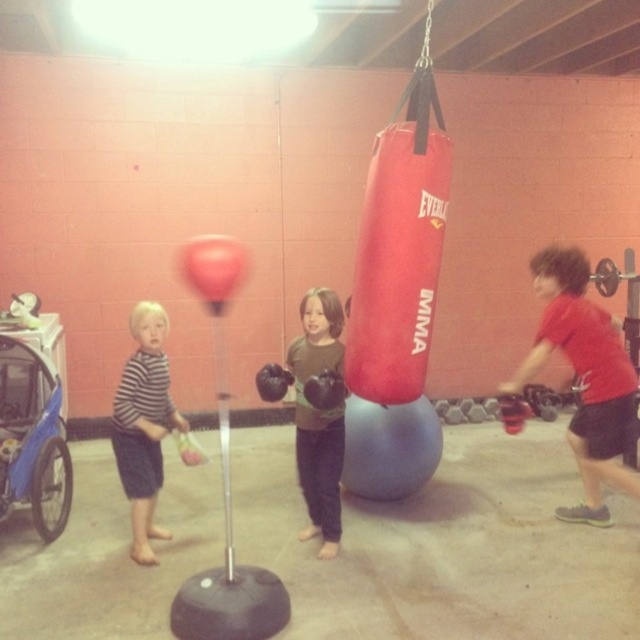
Between red matte boxing glove at right and matte black boxing gloves at center, which one appears on the right side from the viewer's perspective?

red matte boxing glove at right

From the picture: Can you confirm if red matte boxing glove at right is wider than matte black boxing gloves at center?

Correct, the width of red matte boxing glove at right exceeds that of matte black boxing gloves at center.

Does point (561, 298) lie in front of point (301, 493)?

Yes, it is in front of point (301, 493).

The height and width of the screenshot is (640, 640). What are the coordinates of `red matte boxing glove at right` in the screenshot? It's located at (582, 378).

Who is shorter, matte black boxing gloves at center or striped cotton shirt at left?

striped cotton shirt at left is shorter.

Which is in front, point (320, 432) or point (156, 461)?

Point (320, 432) is more forward.

Between point (310, 534) and point (140, 500), which one is positioned in front?

Point (140, 500) is in front.

In order to click on matte black boxing gloves at center in this screenshot , I will do `click(316, 412)`.

Is red matte boxing glove at right further to the viewer compared to striped cotton shirt at left?

Yes, red matte boxing glove at right is behind striped cotton shirt at left.

In the scene shown: Is red matte boxing glove at right to the right of striped cotton shirt at left from the viewer's perspective?

Indeed, red matte boxing glove at right is positioned on the right side of striped cotton shirt at left.

Is point (616, 339) positioned before point (134, 525)?

No, (616, 339) is further to viewer.

The height and width of the screenshot is (640, 640). Identify the location of red matte boxing glove at right. (582, 378).